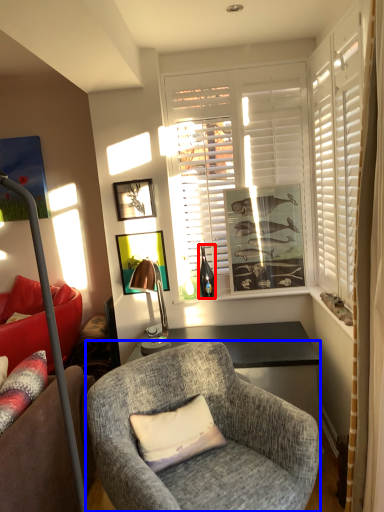
Question: Among these objects, which one is nearest to the camera, bottle (highlighted by a red box) or chair (highlighted by a blue box)?

Choices:
 (A) bottle
 (B) chair

Answer: (B)